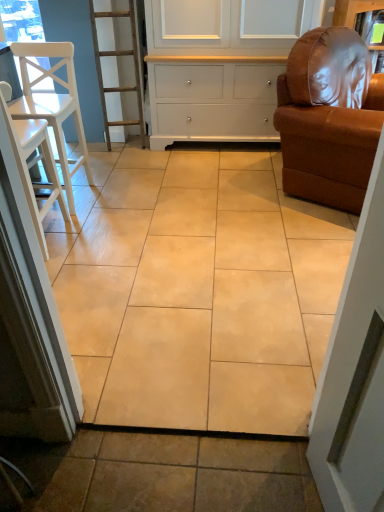
Question: Is white painted wood cabinet at upper center at the back of brown leather armchair at right, placed as the 1th chair when sorted from right to left?

Choices:
 (A) yes
 (B) no

Answer: (A)

Question: From a real-world perspective, is brown leather armchair at right, placed as the 1th chair when sorted from right to left, on top of white painted wood cabinet at upper center?

Choices:
 (A) no
 (B) yes

Answer: (A)

Question: Can you confirm if brown leather armchair at right, placed as the 1th chair when sorted from right to left, is taller than white painted wood cabinet at upper center?

Choices:
 (A) yes
 (B) no

Answer: (B)

Question: Does brown leather armchair at right, the third chair in the left-to-right sequence, contain white painted wood cabinet at upper center?

Choices:
 (A) yes
 (B) no

Answer: (B)

Question: Is brown leather armchair at right, placed as the 1th chair when sorted from right to left, oriented towards white painted wood cabinet at upper center?

Choices:
 (A) no
 (B) yes

Answer: (A)

Question: Considering the relative sizes of brown leather armchair at right, placed as the 1th chair when sorted from right to left, and white painted wood cabinet at upper center in the image provided, is brown leather armchair at right, placed as the 1th chair when sorted from right to left, wider than white painted wood cabinet at upper center?

Choices:
 (A) no
 (B) yes

Answer: (B)

Question: Is the depth of beige ceramic tile at center less than that of white painted wood cabinet at upper center?

Choices:
 (A) yes
 (B) no

Answer: (A)

Question: Is beige ceramic tile at center oriented towards white painted wood cabinet at upper center?

Choices:
 (A) no
 (B) yes

Answer: (A)

Question: From the image's perspective, does beige ceramic tile at center appear higher than white painted wood cabinet at upper center?

Choices:
 (A) yes
 (B) no

Answer: (B)

Question: Is white painted wood cabinet at upper center inside beige ceramic tile at center?

Choices:
 (A) yes
 (B) no

Answer: (B)

Question: Are beige ceramic tile at center and white painted wood cabinet at upper center beside each other?

Choices:
 (A) no
 (B) yes

Answer: (A)

Question: From a real-world perspective, is beige ceramic tile at center positioned over white painted wood cabinet at upper center based on gravity?

Choices:
 (A) yes
 (B) no

Answer: (B)

Question: Considering the relative sizes of white wood chair at left, the second chair viewed from the right, and white painted wood cabinet at upper center in the image provided, is white wood chair at left, the second chair viewed from the right, shorter than white painted wood cabinet at upper center?

Choices:
 (A) yes
 (B) no

Answer: (A)